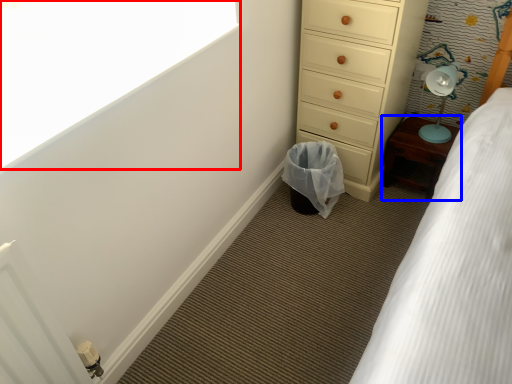
Question: Among these objects, which one is nearest to the camera, window screen (highlighted by a red box) or furniture (highlighted by a blue box)?

Choices:
 (A) window screen
 (B) furniture

Answer: (A)